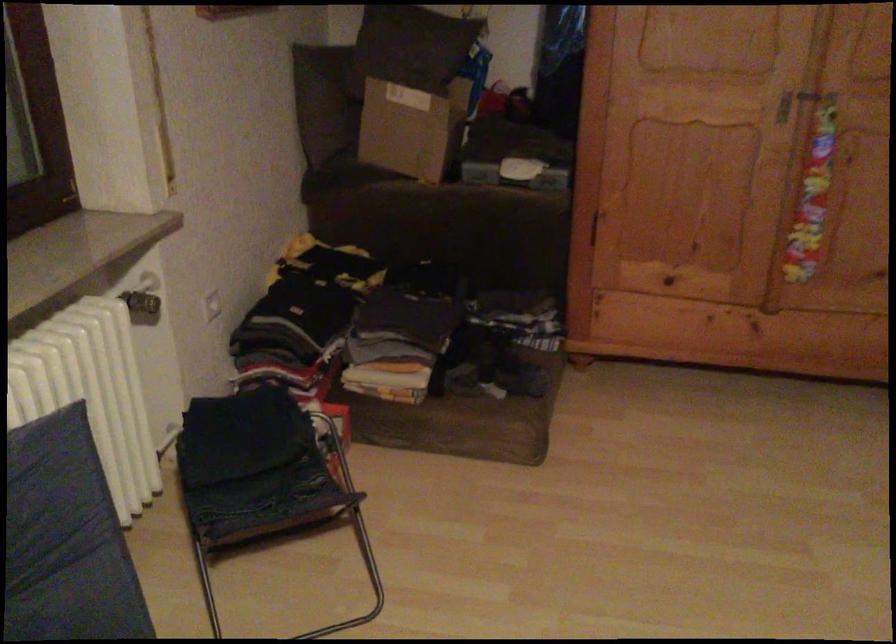
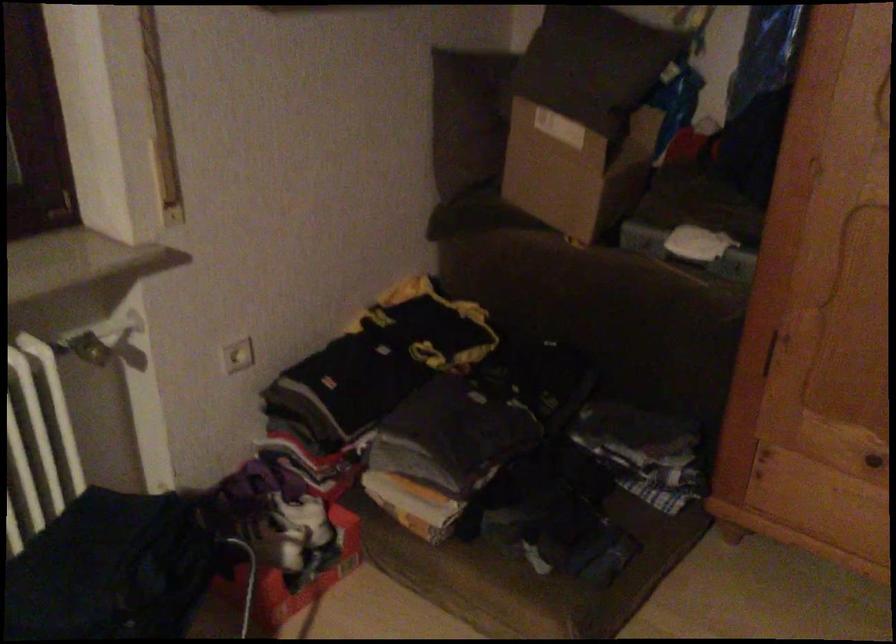
Question: The camera is either moving clockwise (left) or counter-clockwise (right) around the object. The first image is from the beginning of the video and the second image is from the end. Is the camera moving left or right when shooting the video?

Choices:
 (A) Left
 (B) Right

Answer: (B)